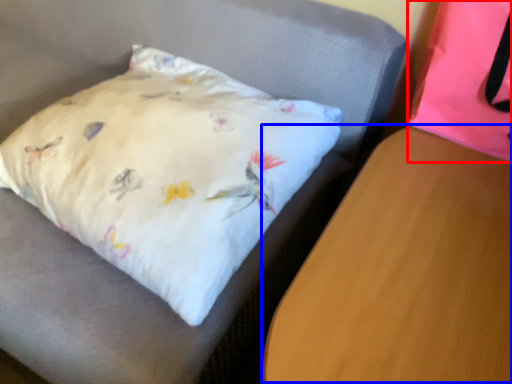
Question: Which object appears closest to the camera in this image, pillow (highlighted by a red box) or table (highlighted by a blue box)?

Choices:
 (A) pillow
 (B) table

Answer: (B)